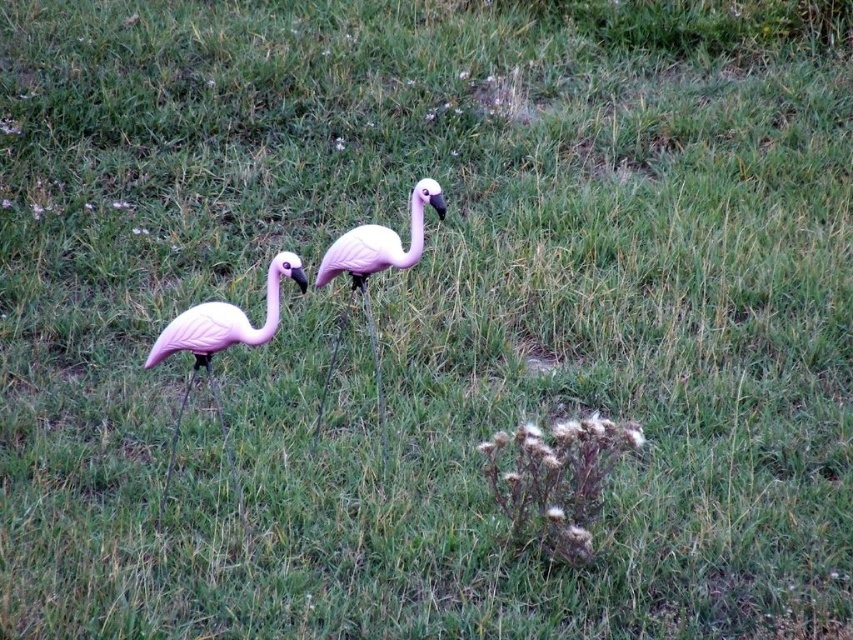
Question: Which object appears closest to the camera in this image?

Choices:
 (A) pink matte plastic flamingo at left
 (B) matte pink flamingo at center

Answer: (A)

Question: Does pink matte plastic flamingo at left have a lesser width compared to matte pink flamingo at center?

Choices:
 (A) yes
 (B) no

Answer: (B)

Question: Can you confirm if pink matte plastic flamingo at left is positioned to the right of matte pink flamingo at center?

Choices:
 (A) no
 (B) yes

Answer: (A)

Question: From the image, what is the correct spatial relationship of pink matte plastic flamingo at left in relation to matte pink flamingo at center?

Choices:
 (A) left
 (B) right

Answer: (A)

Question: Which object is farther from the camera taking this photo?

Choices:
 (A) pink matte plastic flamingo at left
 (B) matte pink flamingo at center

Answer: (B)

Question: Among these objects, which one is nearest to the camera?

Choices:
 (A) pink matte plastic flamingo at left
 (B) matte pink flamingo at center

Answer: (A)